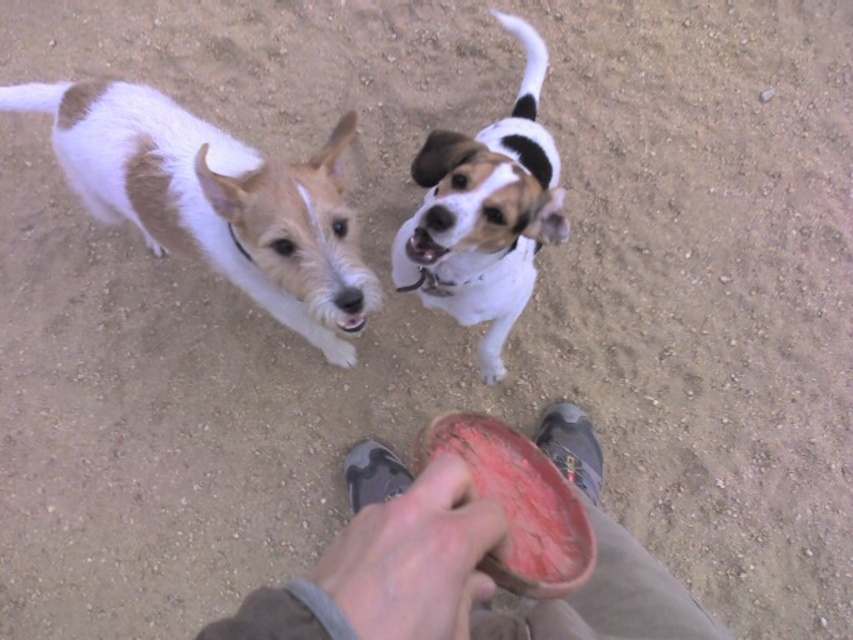
Between brown and white fur at upper left and white fur dog at upper center, which one is positioned higher?

Answer: white fur dog at upper center is above.

Between brown and white fur at upper left and white fur dog at upper center, which one appears on the left side from the viewer's perspective?

Positioned to the left is brown and white fur at upper left.

Locate an element on the screen. brown and white fur at upper left is located at coordinates (215, 200).

This screenshot has height=640, width=853. Identify the location of smooth leather shoe at lower center. [x=463, y=563].

Does smooth leather shoe at lower center have a lesser height compared to white fur dog at upper center?

Yes, smooth leather shoe at lower center is shorter than white fur dog at upper center.

Does point (440, 570) lie in front of point (540, 232)?

Yes, it is.

You are a GUI agent. You are given a task and a screenshot of the screen. Output one action in this format:
    pyautogui.click(x=<x>, y=<y>)
    Task: Click on the smooth leather shoe at lower center
    The width and height of the screenshot is (853, 640).
    Given the screenshot: What is the action you would take?
    pyautogui.click(x=463, y=563)

Can you confirm if smooth leather shoe at lower center is positioned above brown and white fur at upper left?

Incorrect, smooth leather shoe at lower center is not positioned above brown and white fur at upper left.

Does smooth leather shoe at lower center appear on the right side of brown and white fur at upper left?

Correct, you'll find smooth leather shoe at lower center to the right of brown and white fur at upper left.

Does point (404, 525) come in front of point (96, 90)?

Yes.

You are a GUI agent. You are given a task and a screenshot of the screen. Output one action in this format:
    pyautogui.click(x=<x>, y=<y>)
    Task: Click on the smooth leather shoe at lower center
    
    Given the screenshot: What is the action you would take?
    click(463, 563)